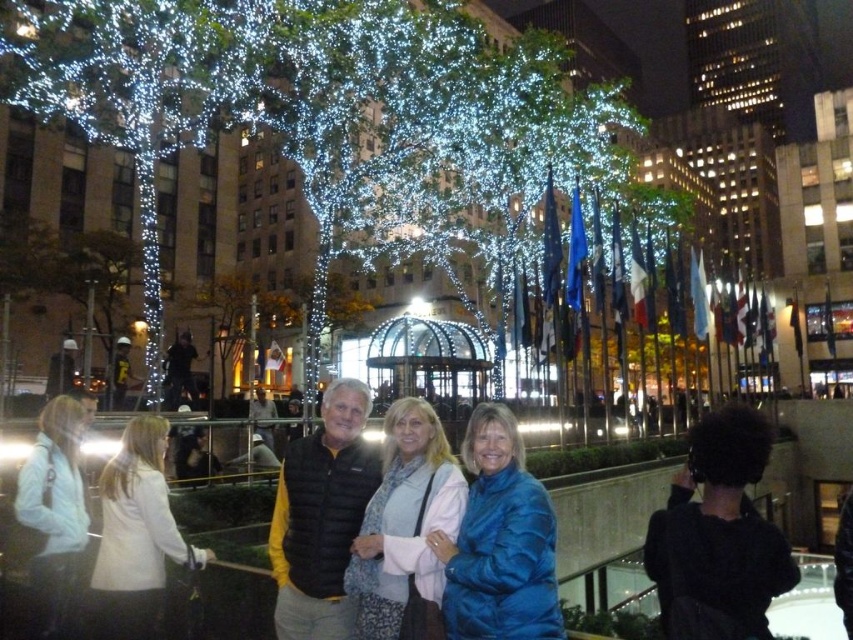
Consider the image. Is illuminated glass tree at center to the left of white fabric jacket at lower left from the viewer's perspective?

Incorrect, illuminated glass tree at center is not on the left side of white fabric jacket at lower left.

The height and width of the screenshot is (640, 853). In order to click on illuminated glass tree at center in this screenshot , I will do `click(326, 115)`.

Identify the location of illuminated glass tree at center. The height and width of the screenshot is (640, 853). (326, 115).

Identify the location of illuminated glass tree at center. (326, 115).

Identify the location of blue shiny jacket at center. The image size is (853, 640). (498, 541).

Does point (521, 620) lie in front of point (334, 580)?

Yes, it is.

At what (x,y) coordinates should I click in order to perform the action: click on blue shiny jacket at center. Please return your answer as a coordinate pair (x, y). This screenshot has width=853, height=640. Looking at the image, I should click on point(498,541).

Is black puffer vest at center bigger than matte black vest at center?

Yes, black puffer vest at center is bigger than matte black vest at center.

In the scene shown: Can you confirm if black puffer vest at center is taller than matte black vest at center?

Yes, black puffer vest at center is taller than matte black vest at center.

Locate an element on the screen. This screenshot has width=853, height=640. black puffer vest at center is located at coordinates (321, 516).

The height and width of the screenshot is (640, 853). Identify the location of black puffer vest at center. (321, 516).